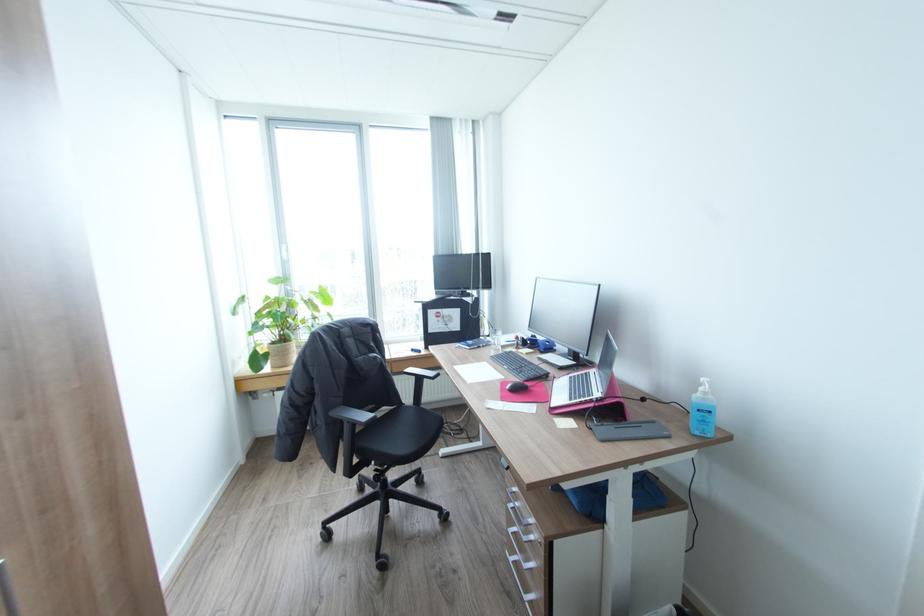
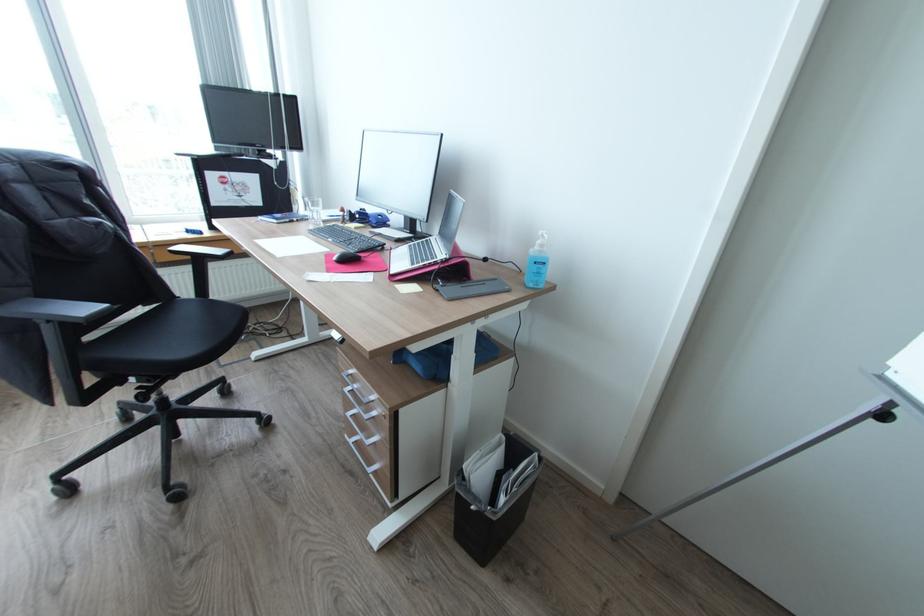
Consider the image. The first image is from the beginning of the video and the second image is from the end. How did the camera likely rotate when shooting the video?

The camera's rotation is toward right-down.